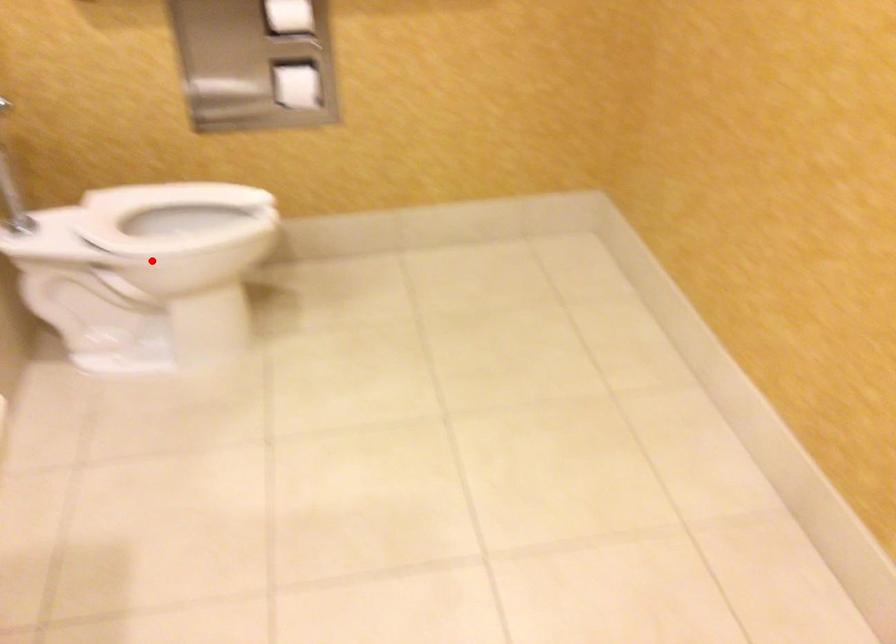
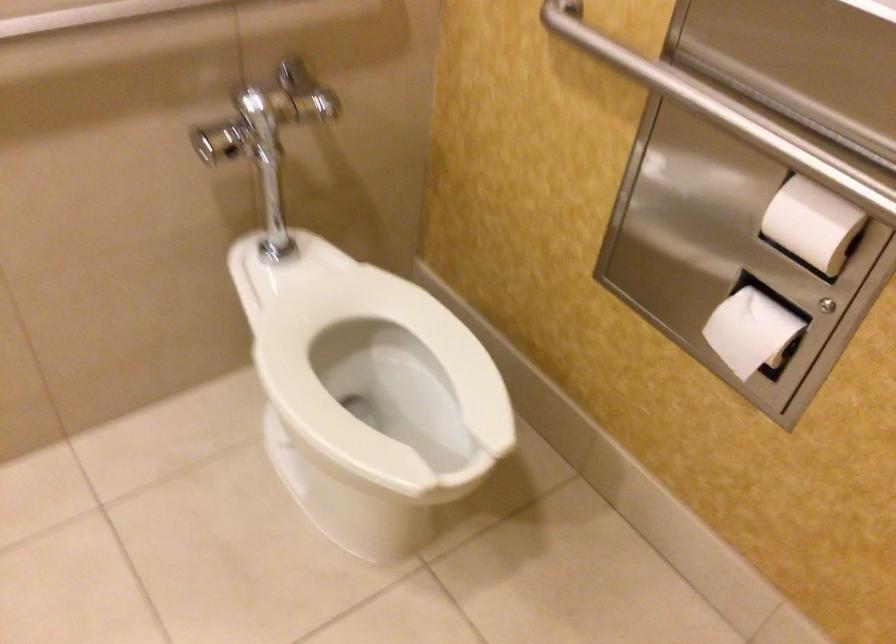
Question: I am providing you with two images of the same scene from different viewpoints. In image1, a red point is highlighted. Considering the same 3D point in image2, which of the following is correct?

Choices:
 (A) It is closer
 (B) It is farther

Answer: (A)